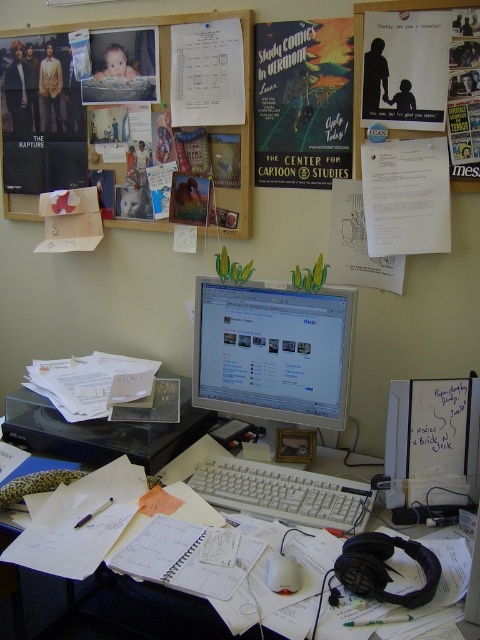
You are organizing the desk and want to place a new sticky note. The sticky note is 5 cm wide. There is a space between the white glossy monitor at center and the matte plastic baby at upper left. Do you think the sticky note can fit in that space vertically?

The white glossy monitor at center is below the matte plastic baby at upper left, so there is vertical space between them. Since the sticky note is only 5 cm wide, it should fit vertically in the space between the white glossy monitor at center and the matte plastic baby at upper left.

You need to place a new item between the white plastic keyboard at center and the matte plastic baby at upper left. Which object should be placed closer to the edge of the desk to ensure the new item fits without overlapping either?

The white plastic keyboard at center is shorter than the matte plastic baby at upper left. To ensure the new item fits without overlapping, place the white plastic keyboard at center closer to the edge of the desk since it is smaller.